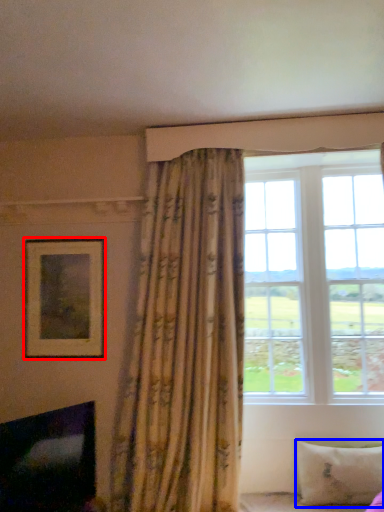
Question: Which point is closer to the camera, picture frame (highlighted by a red box) or pillow (highlighted by a blue box)?

Choices:
 (A) picture frame
 (B) pillow

Answer: (B)